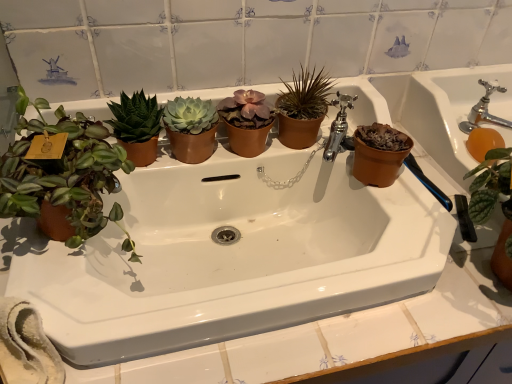
Where is `free spot to the right of brown terracotta pot at right`? free spot to the right of brown terracotta pot at right is located at coordinates (448, 192).